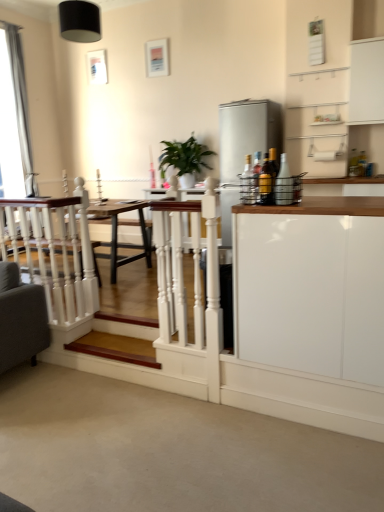
Question: Looking at their shapes, would you say silver metallic curtain at left is wider or thinner than white glossy cabinet at upper right, the first cabinetry from the top?

Choices:
 (A) thin
 (B) wide

Answer: (A)

Question: Which is correct: silver metallic curtain at left is inside white glossy cabinet at upper right, positioned as the first cabinetry in back-to-front order, or outside of it?

Choices:
 (A) inside
 (B) outside

Answer: (B)

Question: Estimate the real-world distances between objects in this image. Which object is farther from the satin silver refrigerator at right?

Choices:
 (A) green glossy plant at center
 (B) silver metallic curtain at left
 (C) translucent glass bottle at right, the first bottle when ordered from right to left
 (D) metallic gold bottle at right, which is the 2th bottle in right-to-left order
 (E) white glossy cabinet at upper right, positioned as the first cabinetry in back-to-front order

Answer: (B)

Question: Estimate the real-world distances between objects in this image. Which object is farther from the wooden step at lower left?

Choices:
 (A) metallic gold bottle at right, arranged as the 2th bottle when viewed from the left
 (B) translucent glass bottle at right, acting as the third bottle starting from the left
 (C) white glossy cabinet at upper right, the first cabinetry from the top
 (D) satin silver refrigerator at right
 (E) green glossy plant at center

Answer: (C)